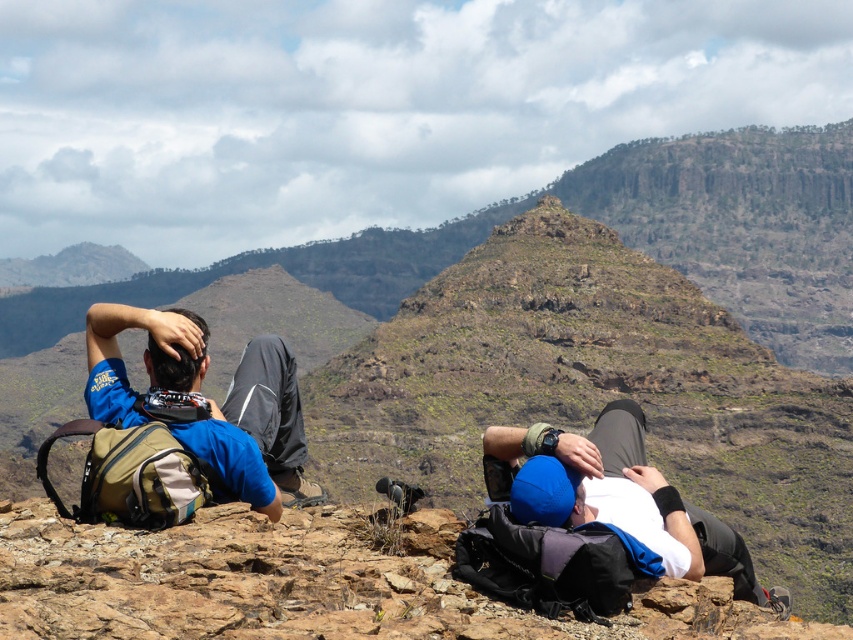
You are a photographer positioned at the base of the rocky outcrop. You want to take a photo that includes both the blue fabric cap at center and the matte blue shirt at left. Which object should you adjust your camera focus to first to ensure both are in focus?

The blue fabric cap at center is closer to the viewer than the matte blue shirt at left, so you should focus on the blue fabric cap at center first to ensure both are in focus.

What is the position of the point at coordinates (x=618, y=497) in the image?

The point at coordinates (x=618, y=497) is located on the blue fabric cap at center.

You are a hiker who wants to place a small rock between the blue fabric cap at center and the matte blue shirt at left. Based on their heights, which object should you place the rock closer to?

The blue fabric cap at center is shorter than the matte blue shirt at left, so you should place the rock closer to the blue fabric cap at center.